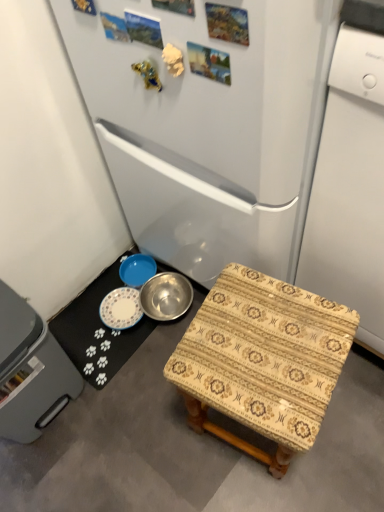
Locate an element on the screen. The height and width of the screenshot is (512, 384). vacant area on top of metallic silver bowl at lower center (from a real-world perspective) is located at coordinates (118, 311).